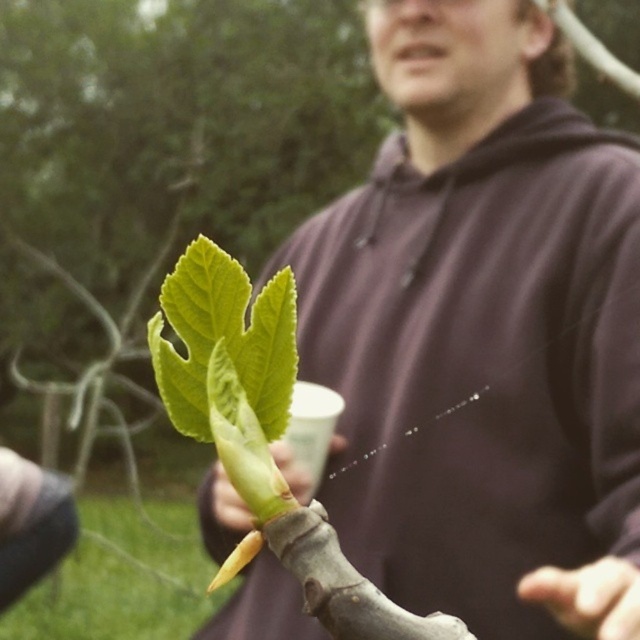
Consider the image. You are a gardener observing the freshly grafted plant. You notice the brown matte hoodie at center and the green matte leaf at center in your view. Which object is wider in your current view?

The brown matte hoodie at center is wider than the green matte leaf at center in the current view.

You are a photographer adjusting your camera settings to capture the grafting point of the plant. You notice two points marked as point 1 at coordinate (532,268) and point 2 at coordinate (195,333). Which point should you focus on to ensure the grafting point is sharp in the photo?

You should focus on point 1 at coordinate (532,268) because it is closer to the camera than point 2 at coordinate (195,333), ensuring the grafting point appears sharp in the photo.

You are a gardener examining the grafted plant. You notice two points marked on the grafting area. Which of the two points, point (356, 486) or point (291, 458), is closer to your eyes?

Point (291, 458) is closer to your eyes because it is less further to the camera than point (356, 486).